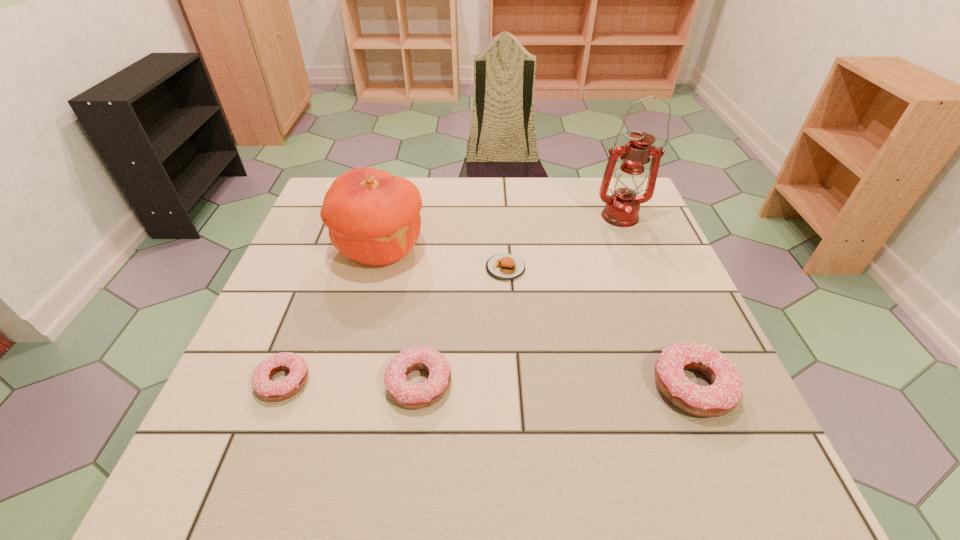
Where is `object that ranks as the fifth closest to the oil lamp`? The image size is (960, 540). object that ranks as the fifth closest to the oil lamp is located at coordinates (264, 388).

You are a GUI agent. You are given a task and a screenshot of the screen. Output one action in this format:
    pyautogui.click(x=<x>, y=<y>)
    Task: Click on the doughnut object that ranks as the second closest to the oil lamp
    
    Given the screenshot: What is the action you would take?
    [x=412, y=396]

Locate which doughnut is the closest to the third shortest object. Please provide its 2D coordinates. Your answer should be formatted as a tuple, i.e. [(x, y)], where the tuple contains the x and y coordinates of a point satisfying the conditions above.

[(264, 388)]

In order to click on free space that satisfies the following two spatial constraints: 1. on the back side of the food; 2. on the left side of the leftmost doughnut in this screenshot , I will do `click(326, 268)`.